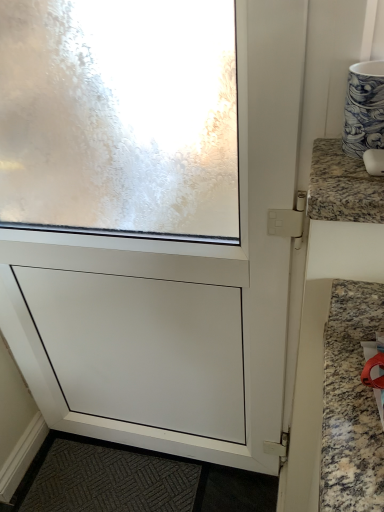
Question: Is white matte screen door at center closer to camera compared to granite mouse at upper right?

Choices:
 (A) yes
 (B) no

Answer: (B)

Question: From a real-world perspective, does white matte screen door at center stand above granite mouse at upper right?

Choices:
 (A) yes
 (B) no

Answer: (B)

Question: From a real-world perspective, is white matte screen door at center positioned under granite mouse at upper right based on gravity?

Choices:
 (A) yes
 (B) no

Answer: (A)

Question: Can you confirm if white matte screen door at center is positioned to the right of granite mouse at upper right?

Choices:
 (A) no
 (B) yes

Answer: (A)

Question: Is white matte screen door at center turned away from granite mouse at upper right?

Choices:
 (A) yes
 (B) no

Answer: (B)

Question: Is white matte screen door at center touching granite mouse at upper right?

Choices:
 (A) no
 (B) yes

Answer: (A)

Question: Is the position of granite mouse at upper right more distant than that of white matte screen door at center?

Choices:
 (A) yes
 (B) no

Answer: (B)

Question: Is granite mouse at upper right positioned far away from white matte screen door at center?

Choices:
 (A) yes
 (B) no

Answer: (B)

Question: From a real-world perspective, is granite mouse at upper right under white matte screen door at center?

Choices:
 (A) no
 (B) yes

Answer: (A)

Question: Considering the relative positions of granite mouse at upper right and white matte screen door at center in the image provided, is granite mouse at upper right to the right of white matte screen door at center from the viewer's perspective?

Choices:
 (A) no
 (B) yes

Answer: (B)

Question: Is the position of granite mouse at upper right less distant than that of white matte screen door at center?

Choices:
 (A) no
 (B) yes

Answer: (B)

Question: Considering the relative sizes of granite mouse at upper right and white matte screen door at center in the image provided, is granite mouse at upper right bigger than white matte screen door at center?

Choices:
 (A) yes
 (B) no

Answer: (B)

Question: Is point (51, 424) closer or farther from the camera than point (316, 187)?

Choices:
 (A) farther
 (B) closer

Answer: (A)